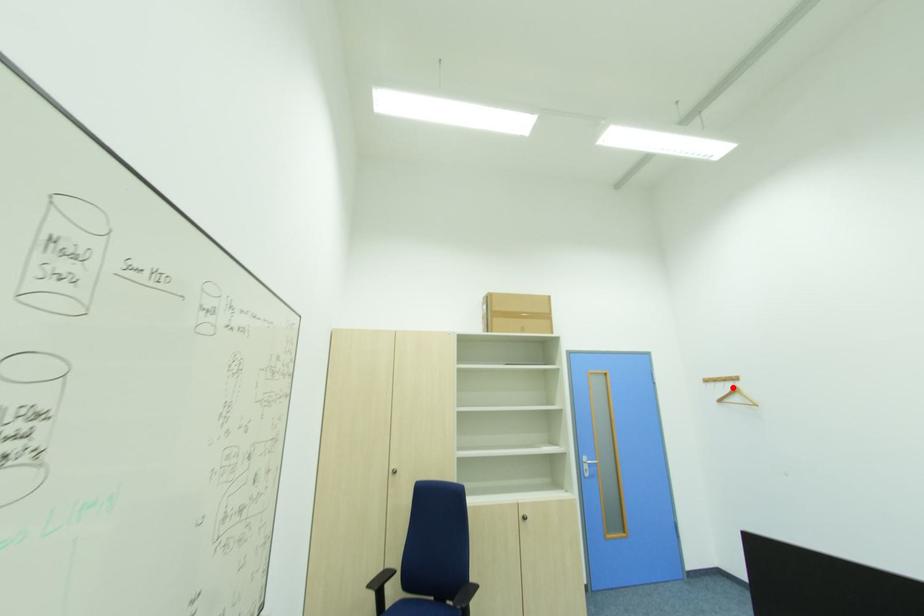
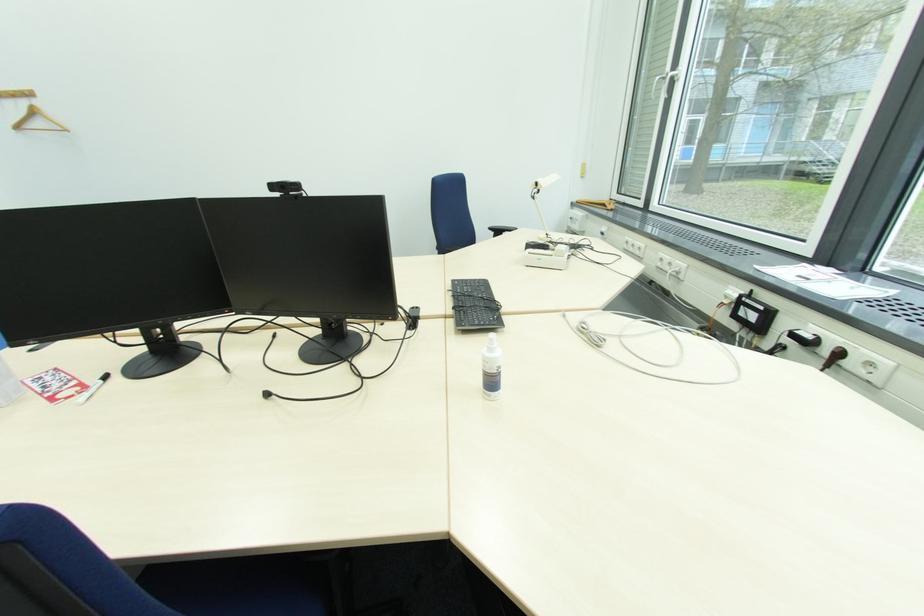
Find the pixel in the second image that matches the highlighted location in the first image.

(29, 105)